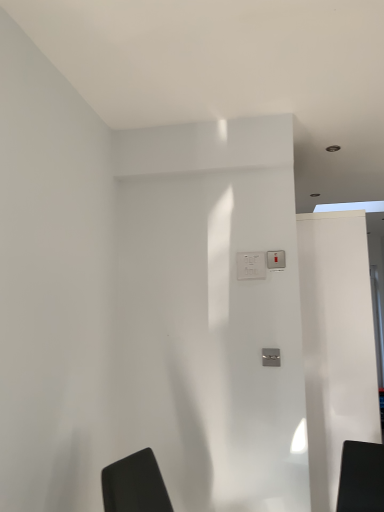
Question: Considering the positions of point (238, 266) and point (354, 372), is point (238, 266) closer or farther from the camera than point (354, 372)?

Choices:
 (A) farther
 (B) closer

Answer: (B)

Question: Considering the positions of white plastic electric outlet at center and white glossy screen door at right in the image, is white plastic electric outlet at center wider or thinner than white glossy screen door at right?

Choices:
 (A) wide
 (B) thin

Answer: (B)

Question: Which object is the farthest from the white plastic electric outlet at center?

Choices:
 (A) metallic silver light switch at center
 (B) white glossy screen door at right

Answer: (B)

Question: Estimate the real-world distances between objects in this image. Which object is farther from the white glossy screen door at right?

Choices:
 (A) metallic silver light switch at center
 (B) white plastic electric outlet at center

Answer: (B)